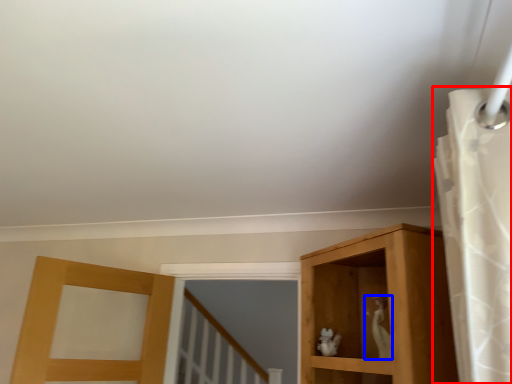
Question: Which object is further to the camera taking this photo, shower curtain (highlighted by a red box) or animal (highlighted by a blue box)?

Choices:
 (A) shower curtain
 (B) animal

Answer: (B)